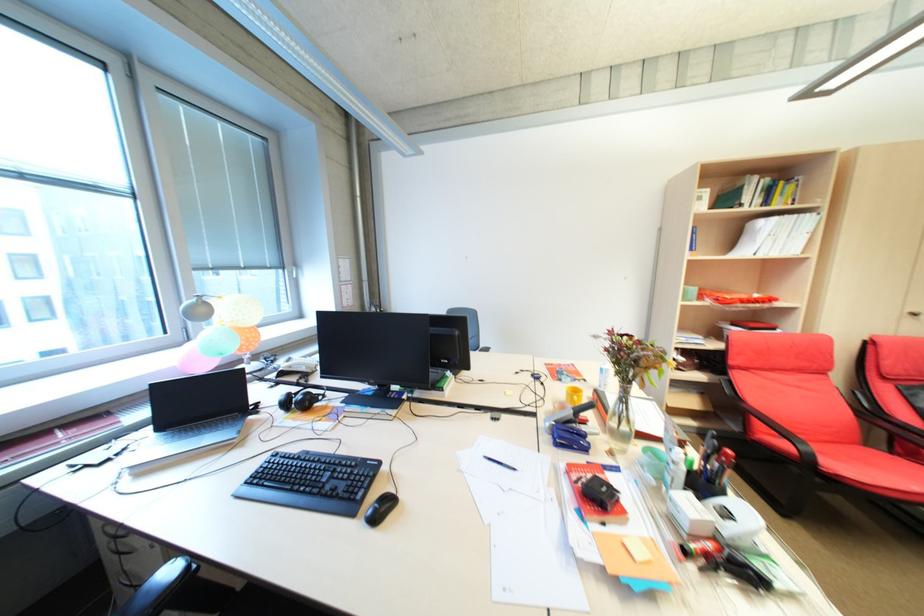
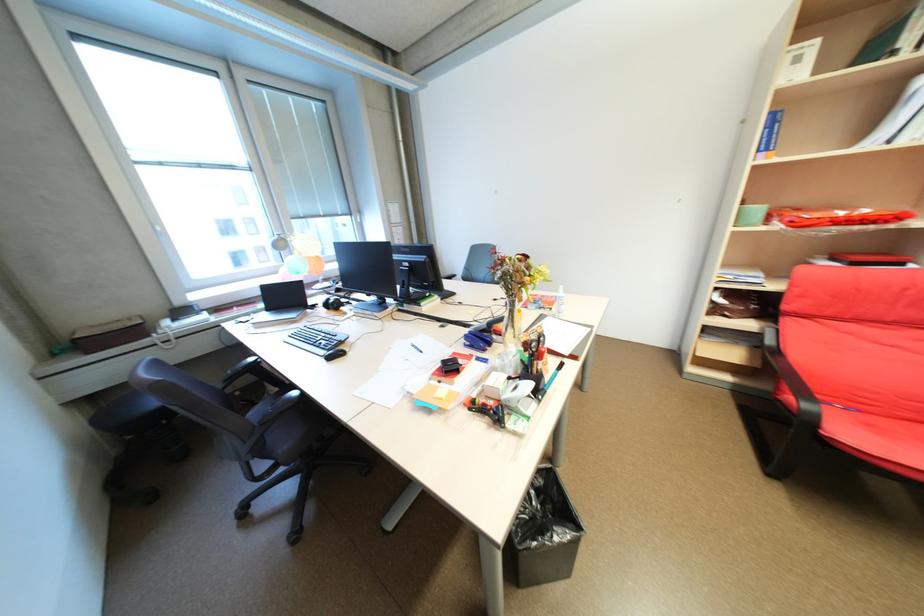
Locate, in the second image, the point that corresponds to (x=359, y=467) in the first image.

(342, 336)